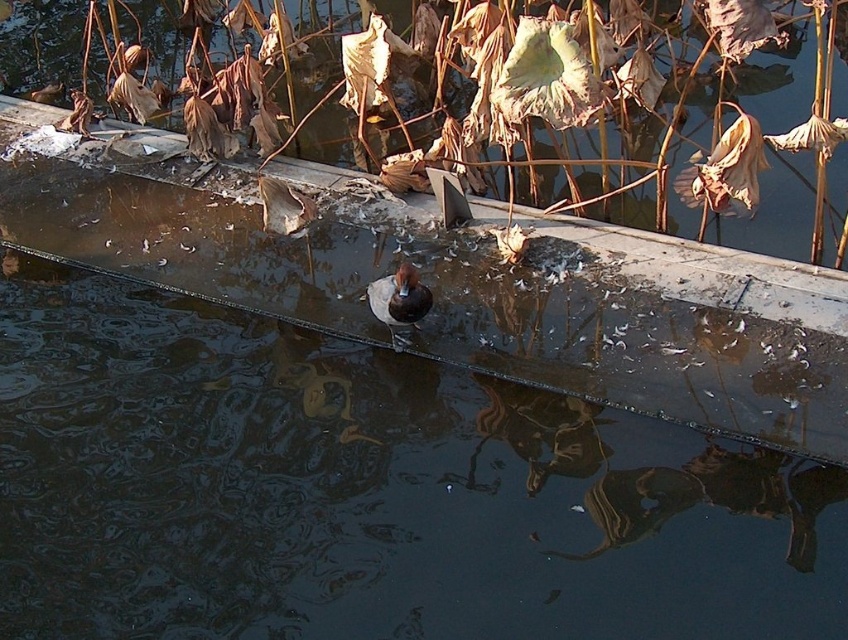
You are standing on the concrete ledge and see the brown dried leaves at upper center and the brown matte duck at center. Which object is closer to your right side?

The brown dried leaves at upper center are to the right of the brown matte duck at center, so they are closer to your right side.

You are standing at the edge of the water and want to place a small decorative rock on the concrete ledge. The coordinates for the desired location are point (487, 99). According to the image, what object is already present at that location?

The point (487, 99) corresponds to brown dried leaves at upper center, so placing the rock there would require moving those leaves first.

You are standing at the point with coordinates point (411, 307). You want to walk towards the point with coordinates point (768, 93). Will you be moving towards the water or away from it?

Since point (768, 93) is behind point (411, 307), moving towards it would mean moving away from the water body. Therefore, you are moving away from the water.